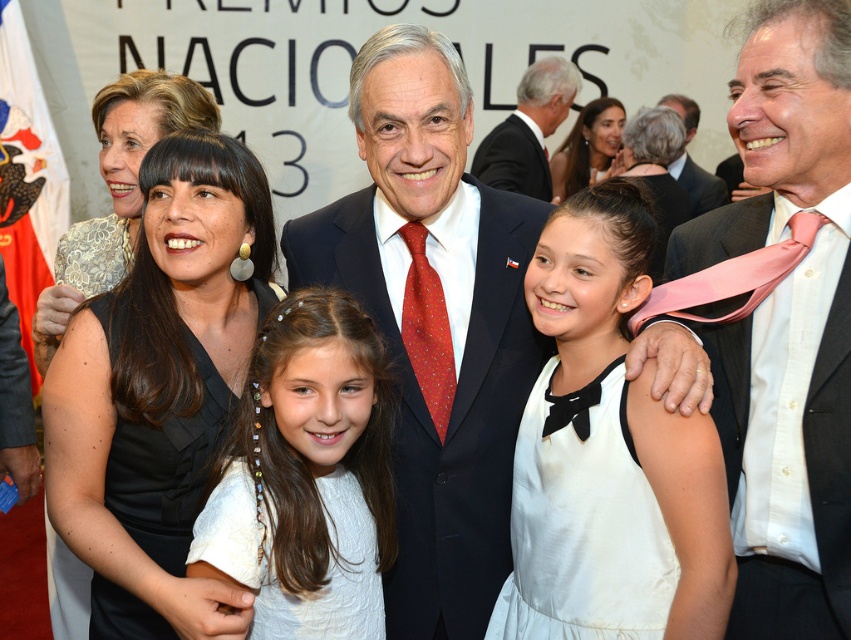
You are a photographer adjusting the lighting for the group photo. The spotlight you are using has a limited range and can only illuminate objects within a 0.2 radius from the center point. The center point of the spotlight is at coordinates point 0.5, 0.5. Will the black matte dress at center be illuminated by the spotlight?

The black matte dress at center is located at point (158, 385). The distance from the spotlight center at (425, 320) to this point is sqrt of squared differences in x and y coordinates. Calculating the distance between these points, the distance is sqrt of 0.103 squared plus 0.313 squared. 0.103 squared is (266, 6) squared is 0.0979. Adding them gives 0.1085. Square root of that is approximately 0.329. Since 0.329 is greater than 0.2, the black matte dress at center is outside the spotlight range and W

In the scene of the formal event with the banner reading PREMIOS NACIONALES 2013, there is a pink silk tie at center and a black matte dress at center. Which object takes up more space in the image?

The black matte dress at center occupies more space than the pink silk tie at center.

You are a photographer at the event and want to ensure the pink silk tie at center and the black matte dress at center are both visible in the photo. Which one is positioned higher in the frame?

The pink silk tie at center is located above the black matte dress at center, so it is positioned higher in the frame.